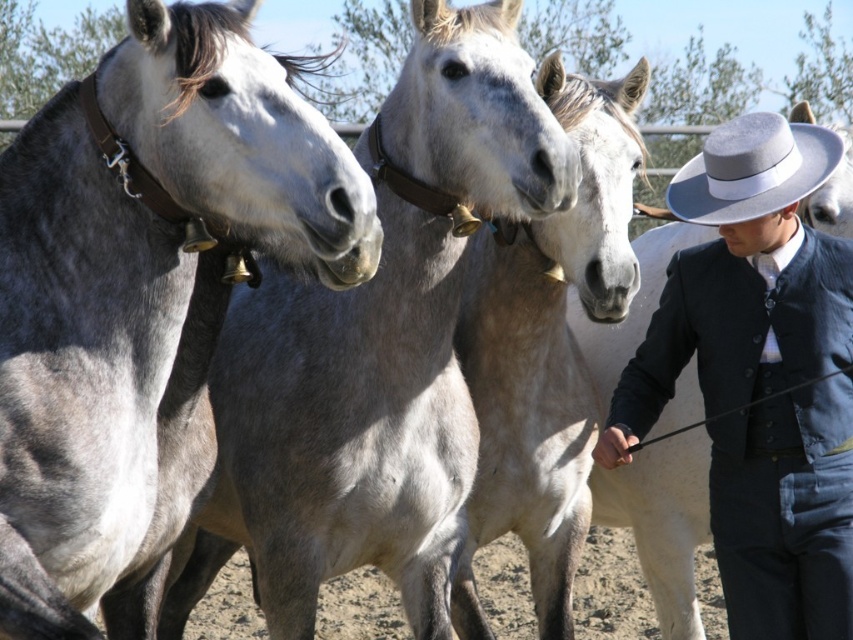
Does gray smooth horse at center have a smaller size compared to gray felt cowboy hat at upper right?

Actually, gray smooth horse at center might be larger than gray felt cowboy hat at upper right.

Between gray smooth horse at center and gray felt cowboy hat at upper right, which one has less height?

With less height is gray felt cowboy hat at upper right.

Is point (395, 566) closer to viewer compared to point (704, 212)?

No.

Image resolution: width=853 pixels, height=640 pixels. In order to click on gray smooth horse at center in this screenshot , I will do `click(375, 349)`.

Is point (815, 269) positioned before point (471, 524)?

Yes, point (815, 269) is closer to viewer.

Who is lower down, dark blue fabric jacket at center right or gray matte horse at center?

Positioned lower is gray matte horse at center.

Between point (721, 396) and point (503, 348), which one is positioned in front?

Point (721, 396) is in front.

Where is `dark blue fabric jacket at center right`? This screenshot has height=640, width=853. dark blue fabric jacket at center right is located at coordinates point(759,376).

Consider the image. How much distance is there between gray matte horse at left and gray felt cowboy hat at upper right?

4.01 feet

Where is `gray matte horse at left`? This screenshot has width=853, height=640. gray matte horse at left is located at coordinates (143, 296).

Find the location of a particular element. The height and width of the screenshot is (640, 853). gray matte horse at left is located at coordinates (143, 296).